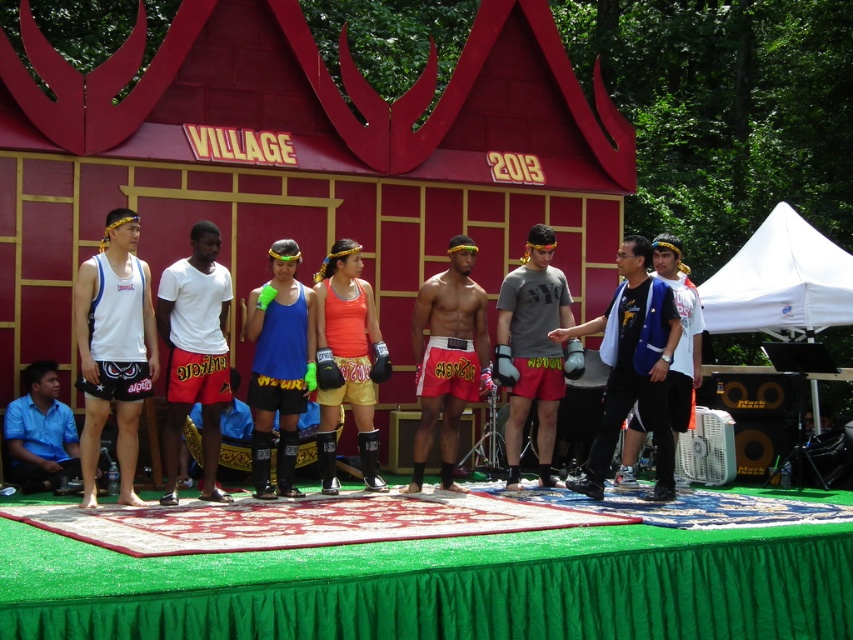
Can you confirm if blue fabric shirt at center is positioned to the left of blue fabric shirt at lower left?

No, blue fabric shirt at center is not to the left of blue fabric shirt at lower left.

Which is below, blue fabric shirt at center or blue fabric shirt at lower left?

Positioned lower is blue fabric shirt at lower left.

You are a GUI agent. You are given a task and a screenshot of the screen. Output one action in this format:
    pyautogui.click(x=<x>, y=<y>)
    Task: Click on the blue fabric shirt at center
    This screenshot has width=853, height=640.
    Given the screenshot: What is the action you would take?
    pyautogui.click(x=633, y=365)

Which is more to the right, gray cotton shirt at center or blue fabric shirt at lower left?

gray cotton shirt at center

What do you see at coordinates (532, 348) in the screenshot? I see `gray cotton shirt at center` at bounding box center [532, 348].

This screenshot has height=640, width=853. In order to click on gray cotton shirt at center in this screenshot , I will do `click(532, 348)`.

Is white fabric shorts at center to the right of reddish-brown fabric shorts at center from the viewer's perspective?

No, white fabric shorts at center is not to the right of reddish-brown fabric shorts at center.

Is point (222, 378) less distant than point (466, 362)?

Yes, it is in front of point (466, 362).

Which is behind, point (216, 339) or point (489, 380)?

The point (489, 380) is more distant.

Locate an element on the screen. white fabric shorts at center is located at coordinates (194, 352).